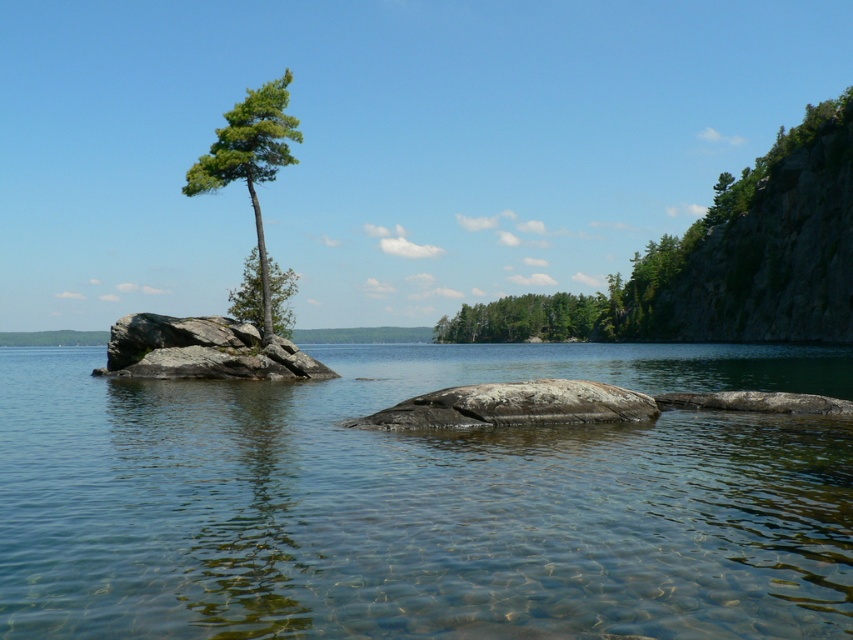
You are standing at the edge of the lakeside and want to reach the clear water at center. According to the coordinates provided, which direction should you move to reach it?

The clear water at center is located at point 0.784 on the x and 0.496 on the y axis. Since you are at the edge, you should move towards the center of the image to reach it.

You are standing at the lakeside and want to walk to the distant shoreline. You notice two points marked on the rocks in the water. Which point, point 1 at coordinates [630,509] or point 2 at [543,328], is closer to you as you stand at the lakeside?

Point 1 at coordinates [630,509] is closer to you than point 2 at [543,328] because it is positioned nearer to the viewer in the scene.